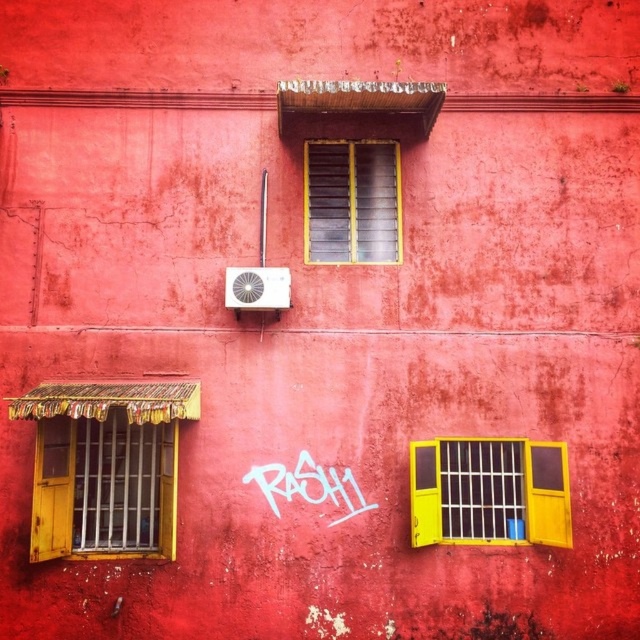
You are standing in front of the red wall with three windows and an air conditioning unit. You notice a point marked at coordinates (104, 486). Which object does this point correspond to?

The point marked at coordinates (104, 486) corresponds to the wooden window at left.

You are standing in front of the red wall with three windows and an air conditioning unit. You want to reach the yellow matte window at lower right. Considering the distance, is it possible for you to touch it without moving closer?

The yellow matte window at lower right is 31.34 feet away from the viewer, so it is not possible to touch it without moving closer.